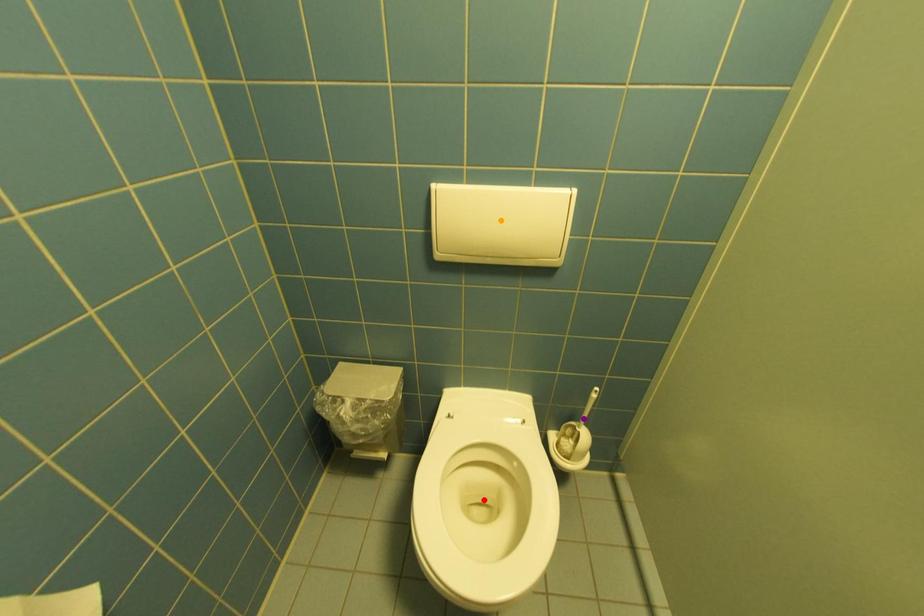
Order these from nearest to farthest:
orange point | red point | purple point

orange point
red point
purple point